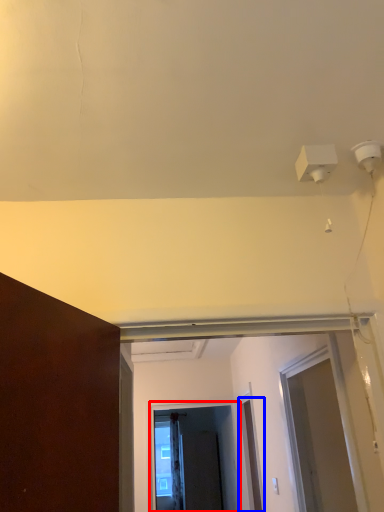
Question: Among these objects, which one is farthest to the camera, screen door (highlighted by a red box) or door (highlighted by a blue box)?

Choices:
 (A) screen door
 (B) door

Answer: (A)